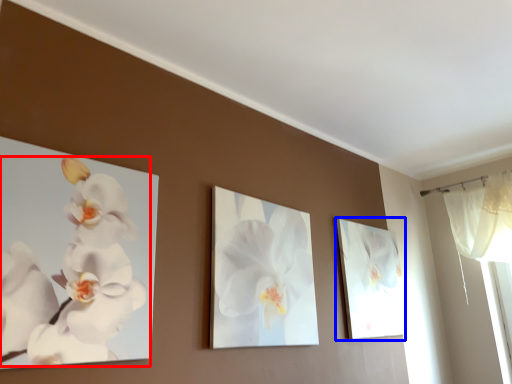
Question: Which object is closer to the camera taking this photo, flower (highlighted by a red box) or picture frame (highlighted by a blue box)?

Choices:
 (A) flower
 (B) picture frame

Answer: (A)